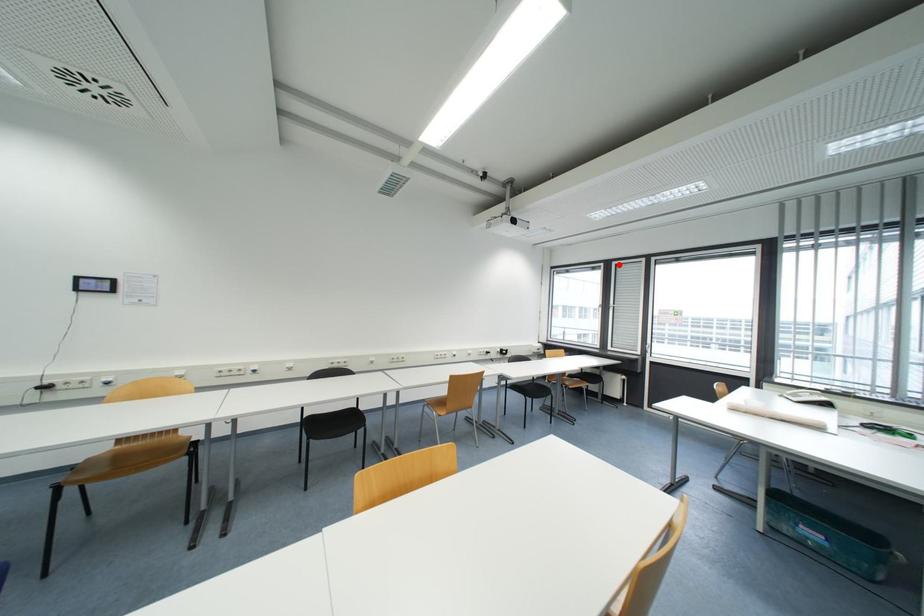
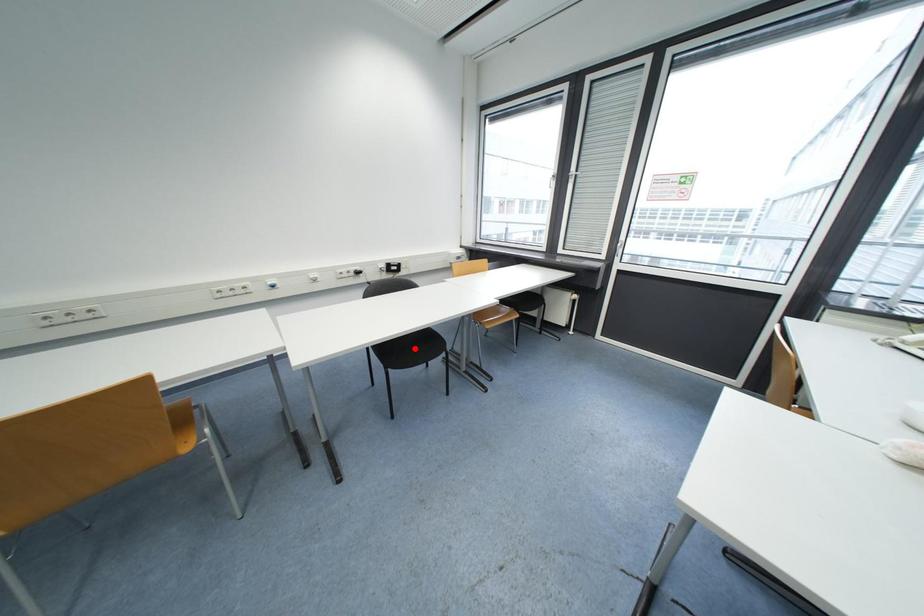
I am providing you with two images of the same scene from different viewpoints. A red point is marked on the first image and another point is marked on the second image. Is the red point in image1 aligned with the point shown in image2?

No